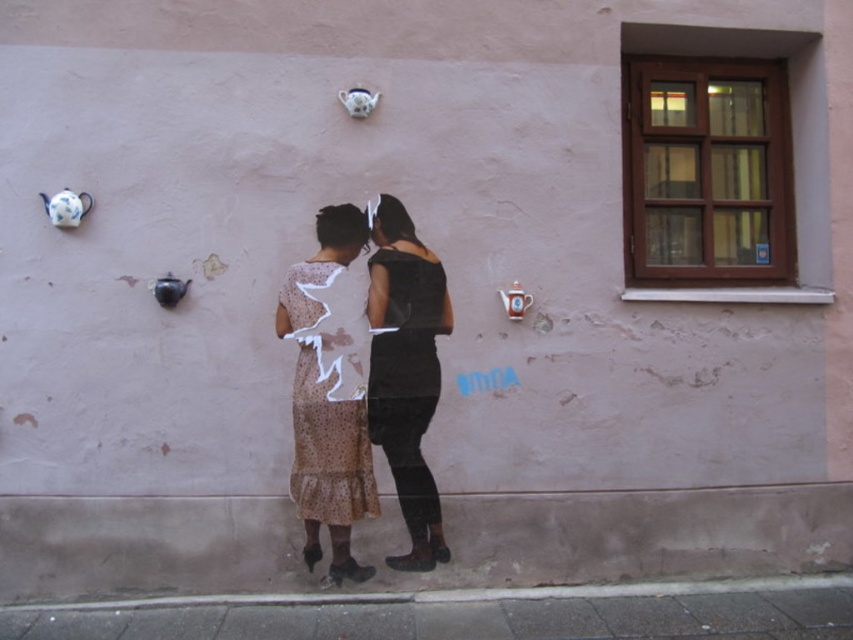
Question: Based on their relative distances, which object is nearer to the black matte dress at center?

Choices:
 (A) brown dotted fabric dress at center
 (B) matte white dress at center

Answer: (B)

Question: From the image, what is the correct spatial relationship of black matte dress at center in relation to brown dotted fabric dress at center?

Choices:
 (A) below
 (B) above

Answer: (B)

Question: From the image, what is the correct spatial relationship of matte white dress at center in relation to brown dotted fabric dress at center?

Choices:
 (A) below
 (B) above

Answer: (B)

Question: Does matte white dress at center come in front of brown dotted fabric dress at center?

Choices:
 (A) yes
 (B) no

Answer: (A)

Question: Which point is farther from the camera taking this photo?

Choices:
 (A) (329, 417)
 (B) (376, 220)
 (C) (395, 252)

Answer: (C)

Question: Which object is the closest to the brown dotted fabric dress at center?

Choices:
 (A) matte white dress at center
 (B) black matte dress at center

Answer: (A)